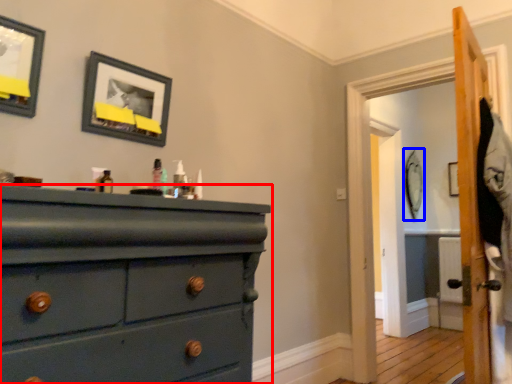
Question: Which object is further to the camera taking this photo, chest of drawers (highlighted by a red box) or picture frame (highlighted by a blue box)?

Choices:
 (A) chest of drawers
 (B) picture frame

Answer: (B)